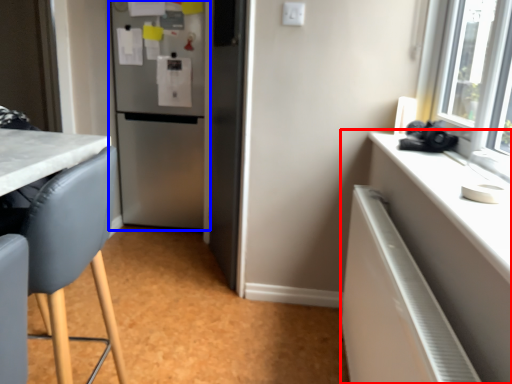
Question: Which of the following is the closest to the observer, cabinetry (highlighted by a red box) or refrigerator (highlighted by a blue box)?

Choices:
 (A) cabinetry
 (B) refrigerator

Answer: (A)